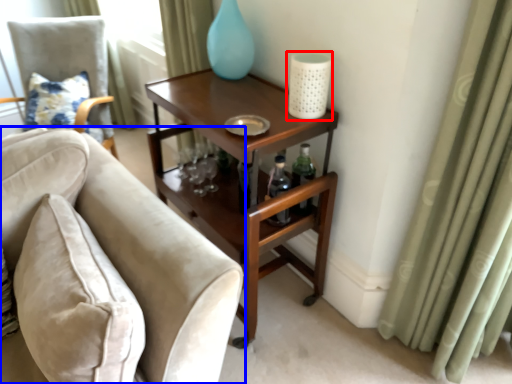
Question: Which point is closer to the camera, candle holder (highlighted by a red box) or chair (highlighted by a blue box)?

Choices:
 (A) candle holder
 (B) chair

Answer: (B)